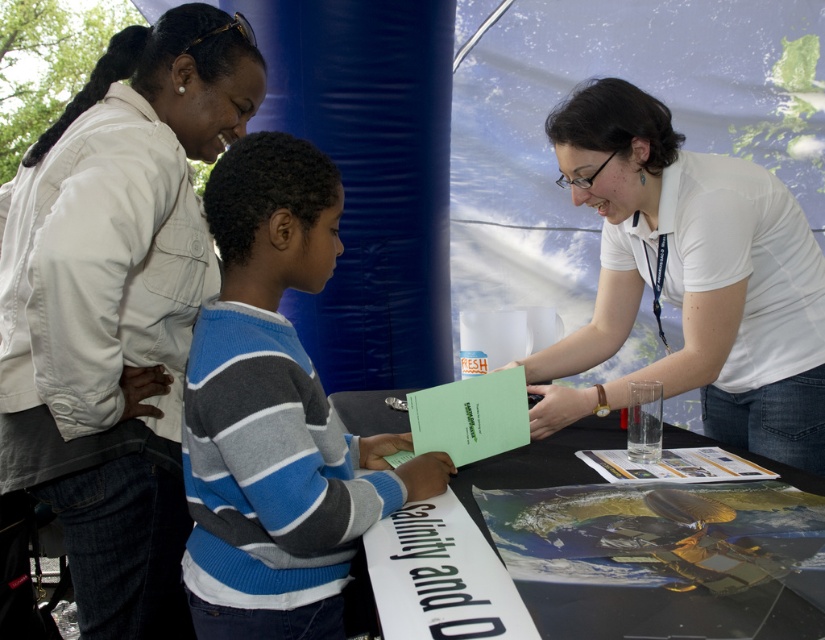
You are a photographer at the event and need to take a photo of the white matte shirt at center and the black plastic table at center. Considering their heights, which object should be placed closer to the camera to ensure both are fully visible in the frame?

The white matte shirt at center is much taller than the black plastic table at center, so to ensure both are fully visible, the black plastic table at center should be placed closer to the camera.

You are standing in the middle of the tent and want to take a photo of both the point at (574, 193) and the point at (764, 592). Which point should you focus on first to ensure both are in focus?

You should focus on the point at (574, 193) first because it is closer to the camera than the point at (764, 592). By focusing on the closer point, the farther point will also be within the depth of field and in focus.

You are organizing a small event and need to place a decorative banner. The banner is 1.2 meters wide. There is a white cotton jacket at upper left and a black paper at lower center in the scene. Which object can the banner be placed over without exceeding its width?

The banner can be placed over the white cotton jacket at upper left because its width is larger than the black paper at lower center, and the banner is 1.2 meters wide which fits within the jacket.